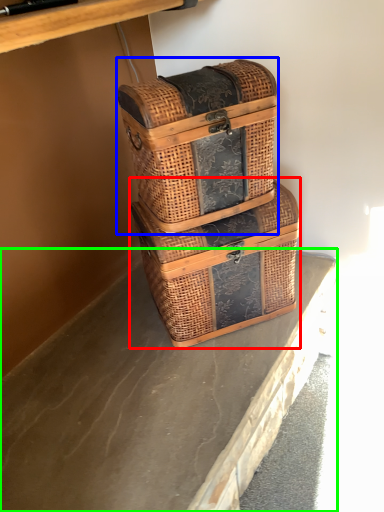
Question: Considering the real-world distances, which object is farthest from picnic basket (highlighted by a red box)? picnic basket (highlighted by a blue box) or concrete (highlighted by a green box)?

Choices:
 (A) picnic basket
 (B) concrete

Answer: (B)